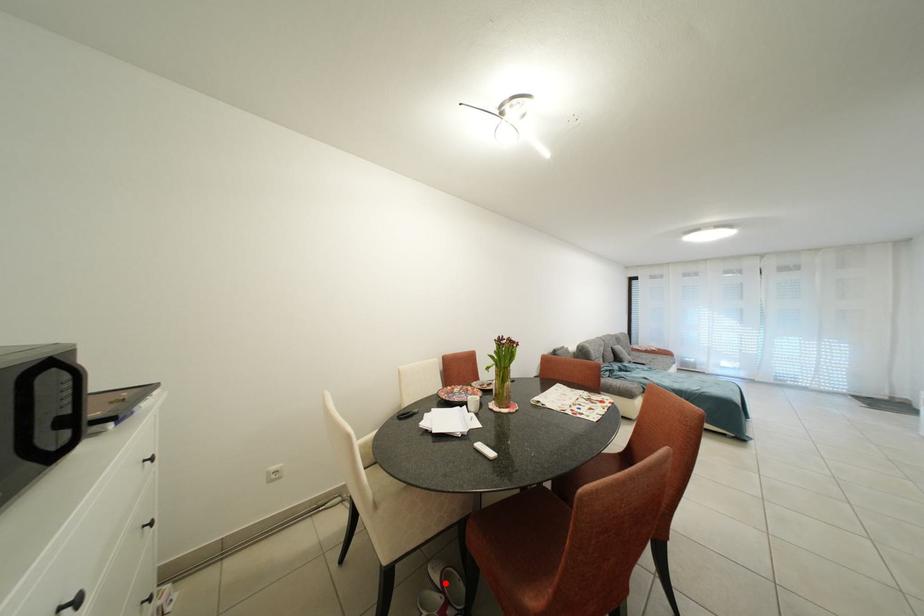
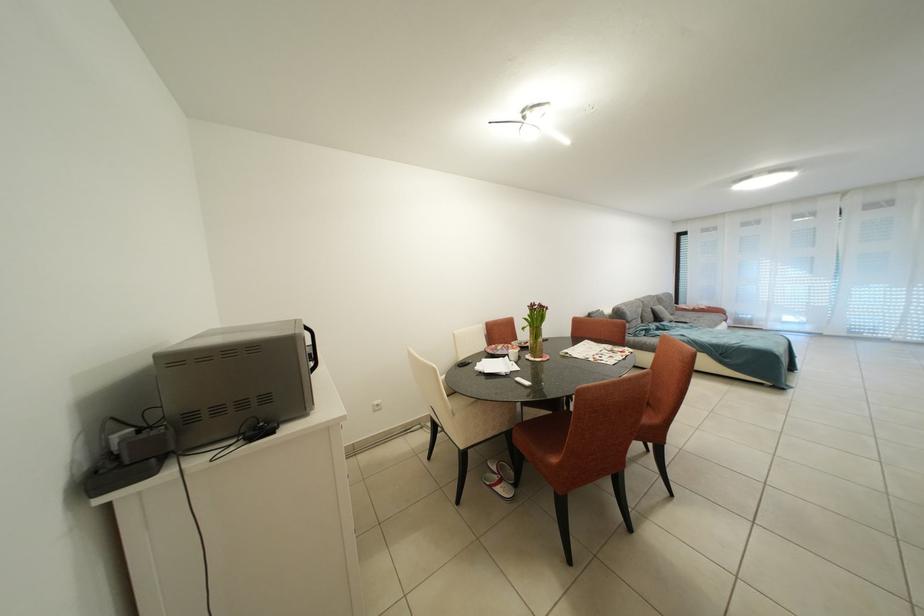
Question: I am providing you with two images of the same scene from different viewpoints. In image1, a red point is highlighted. Considering the same 3D point in image2, which of the following is correct?

Choices:
 (A) It is closer
 (B) It is farther

Answer: (B)